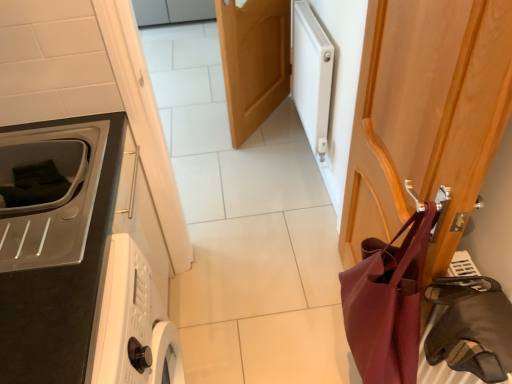
Find the location of a particular element. vacant space situated above leather-like brown bag at right (from a real-world perspective) is located at coordinates (485, 316).